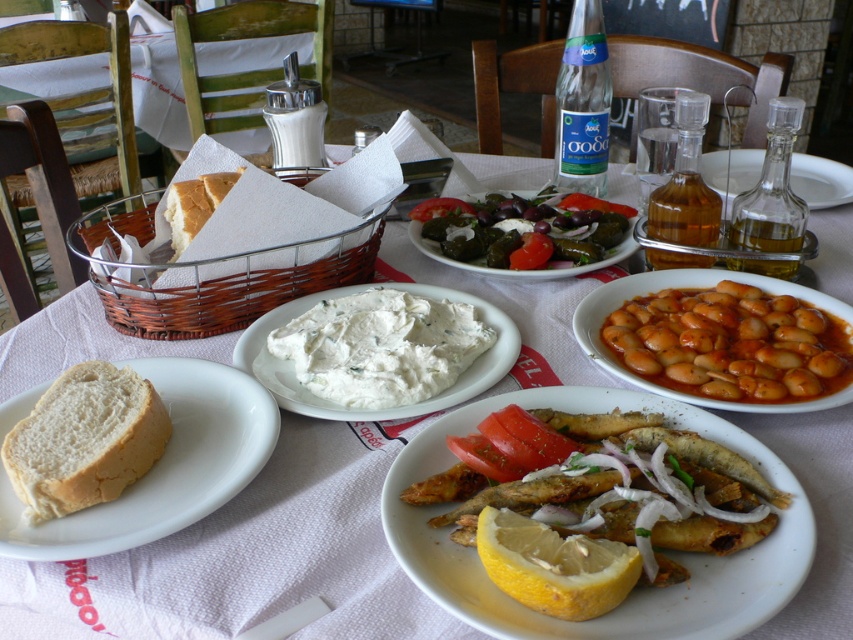
You are a customer at the restaurant and want to place your napkin on the table. The napkin is 10 cm wide. Can you place it at point (730, 344) without overlapping any items?

There are brown matte beans at center right at point (730, 344), so placing the napkin there would overlap with them. Choose another spot.

In the scene shown: You are a customer at a Greek restaurant and want to place your napkin on the table. The napkin is 10 cm wide. The table is 1.5 meters wide. Where should you place the napkin so that it doesn not overlap with the white soft bread at center located at point (84, 440)?

The white soft bread at center is located at point (84, 440). Since the table is 1.5 meters wide, you can place the napkin anywhere on the table except near the coordinates (84, 440) to avoid overlapping with the bread.